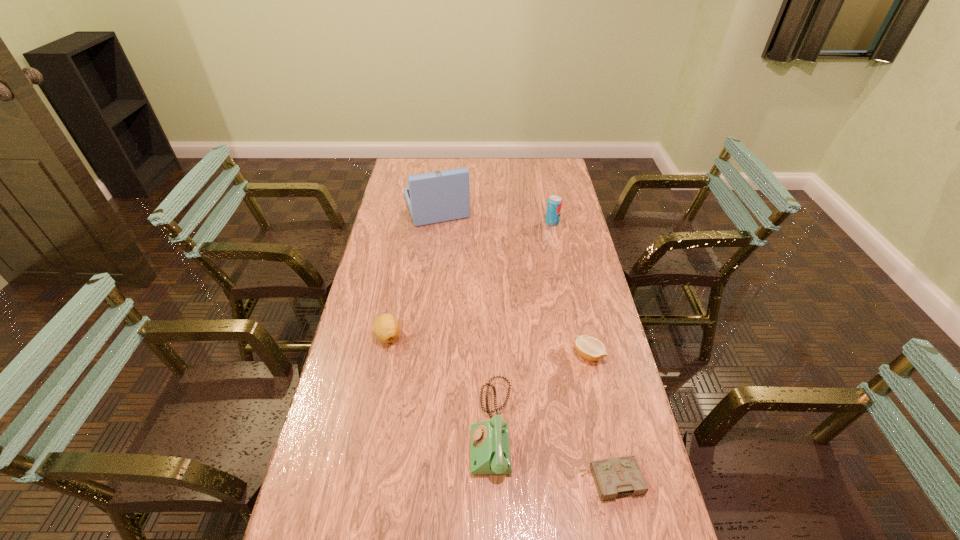
Find the location of `free space at the far edge`. free space at the far edge is located at coordinates (508, 183).

Identify the location of vacant space at the left edge of the desktop. (392, 260).

The height and width of the screenshot is (540, 960). In the image, there is a desktop. What are the coordinates of `free space at the right edge` in the screenshot? It's located at (593, 368).

Where is `free spot at the far right corner of the desktop`? The height and width of the screenshot is (540, 960). free spot at the far right corner of the desktop is located at coordinates click(x=564, y=164).

Find the location of a particular element. The image size is (960, 540). blank region between the right lemon and the taller lemon is located at coordinates (489, 345).

Where is `vacant point located between the third object from left to right and the shorter lemon`? The image size is (960, 540). vacant point located between the third object from left to right and the shorter lemon is located at coordinates (540, 391).

Find the location of a particular element. Image resolution: width=960 pixels, height=540 pixels. free space between the fifth shortest object and the left lemon is located at coordinates (470, 279).

Where is `free area in between the diary and the telephone`? The image size is (960, 540). free area in between the diary and the telephone is located at coordinates (552, 454).

Find the location of `empty location between the left lemon and the diary`. empty location between the left lemon and the diary is located at coordinates (500, 408).

The image size is (960, 540). I want to click on unoccupied position between the left lemon and the fourth object from right to left, so click(x=441, y=382).